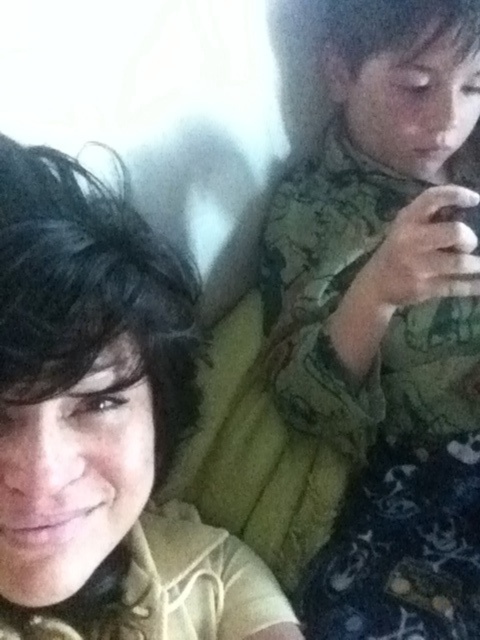
Which is more to the right, camouflage fabric shirt at upper right or yellow fabric pillow at center?

From the viewer's perspective, camouflage fabric shirt at upper right appears more on the right side.

This screenshot has width=480, height=640. Describe the element at coordinates (387, 317) in the screenshot. I see `camouflage fabric shirt at upper right` at that location.

Is point (431, 428) in front of point (263, 496)?

No, (431, 428) is further to viewer.

You are a GUI agent. You are given a task and a screenshot of the screen. Output one action in this format:
    pyautogui.click(x=<x>, y=<y>)
    Task: Click on the camouflage fabric shirt at upper right
    
    Given the screenshot: What is the action you would take?
    coord(387,317)

Is point (359, 572) positioned after point (96, 417)?

Yes, it is behind point (96, 417).

Is point (374, 502) farther from viewer compared to point (159, 472)?

Yes, it is.

What are the coordinates of `camouflage fabric shirt at upper right` in the screenshot? It's located at (387, 317).

From the picture: Is matte yellow shirt at center shorter than yellow fabric pillow at center?

No.

Between matte yellow shirt at center and yellow fabric pillow at center, which one has less height?

With less height is yellow fabric pillow at center.

The height and width of the screenshot is (640, 480). What do you see at coordinates (104, 426) in the screenshot? I see `matte yellow shirt at center` at bounding box center [104, 426].

You are a GUI agent. You are given a task and a screenshot of the screen. Output one action in this format:
    pyautogui.click(x=<x>, y=<y>)
    Task: Click on the matte yellow shirt at center
    
    Given the screenshot: What is the action you would take?
    pyautogui.click(x=104, y=426)